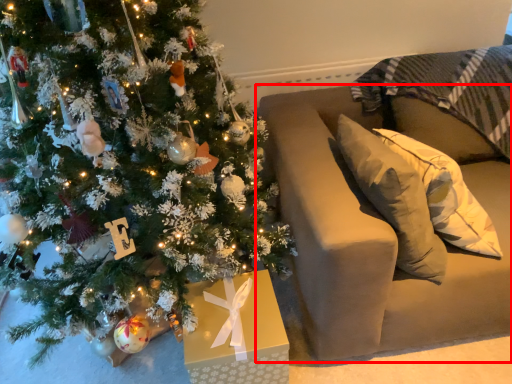
Question: Considering the relative positions of furniture (annotated by the red box) and christmas tree in the image provided, where is furniture (annotated by the red box) located with respect to the staircase?

Choices:
 (A) right
 (B) left

Answer: (A)